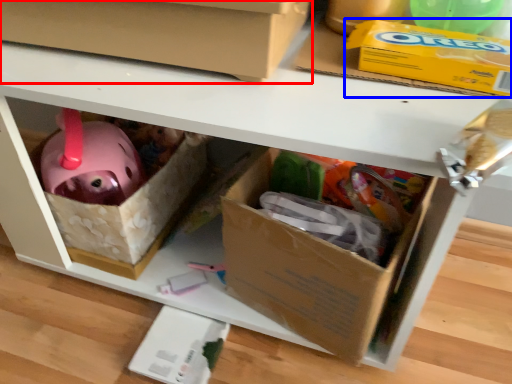
Question: Which object is further to the camera taking this photo, box (highlighted by a red box) or storage box (highlighted by a blue box)?

Choices:
 (A) box
 (B) storage box

Answer: (B)